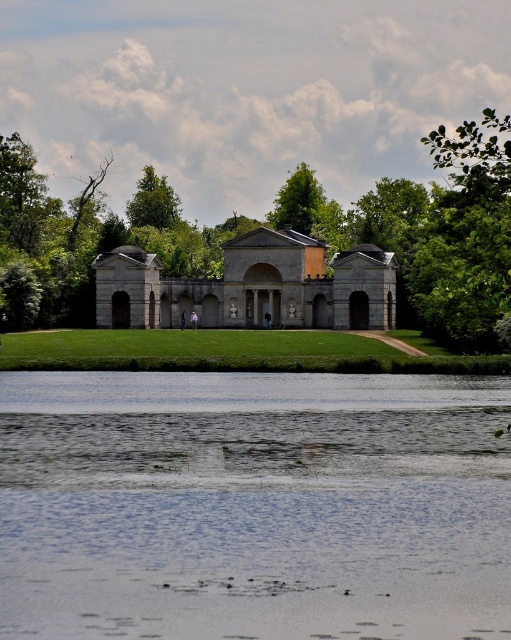
You are standing at the classical building and want to walk to the water. There are two points marked on the path. Which point is closer to the building? The two points are point 1 at coordinates (349, 259) and point 2 at coordinates (212, 316).

Point 1 at coordinates (349, 259) is closer to the classical building because it is in front of point 2 at coordinates (212, 316), which is further away from the building.

You are a gardener planning to plant a new tree in the lawn area between the green leafy tree at center and the green leafy tree at upper right. Based on their current positions, which tree is closer to the building?

The green leafy tree at center is closer to the building because it is positioned under the green leafy tree at upper right, indicating it is located between the building and the upper right tree.